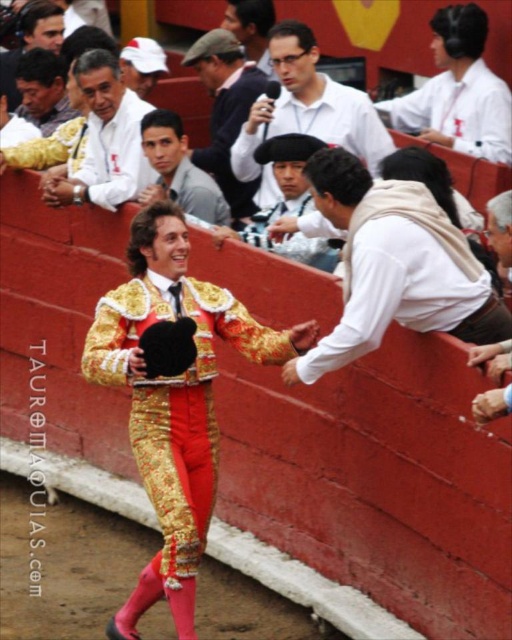
You are a photographer at the bullfighting event. You need to take a photo that includes both the smooth skin face at center and the smooth skin face at upper left. Which face should you zoom in on to ensure both are clearly visible?

To ensure both the smooth skin face at center and the smooth skin face at upper left are clearly visible, you should zoom in on the smooth skin face at upper left since it is larger in size compared to the smooth skin face at center.

You are a photographer trying to capture the matador and the crowd. From your current position, can you see the smooth brown hat at center through the space between the matte white shirt at upper center and the edge of the arena? Please explain.

The smooth brown hat at center is behind the matte white shirt at upper center, so it would be obstructed by the matte white shirt at upper center. Therefore, you cannot see the smooth brown hat at center through that space.

You are a photographer standing in the front row of the bullfighting arena. You want to take a photo of both the smooth skin face at upper left and the smooth brown leather jacket at upper center. Which object should you focus on first to ensure both are in sharp focus?

You should focus on the smooth skin face at upper left first because it is closer to the viewer than the smooth brown leather jacket at upper center. By focusing on the closer object, the depth of field may include the farther object as well, ensuring both are in sharp focus.